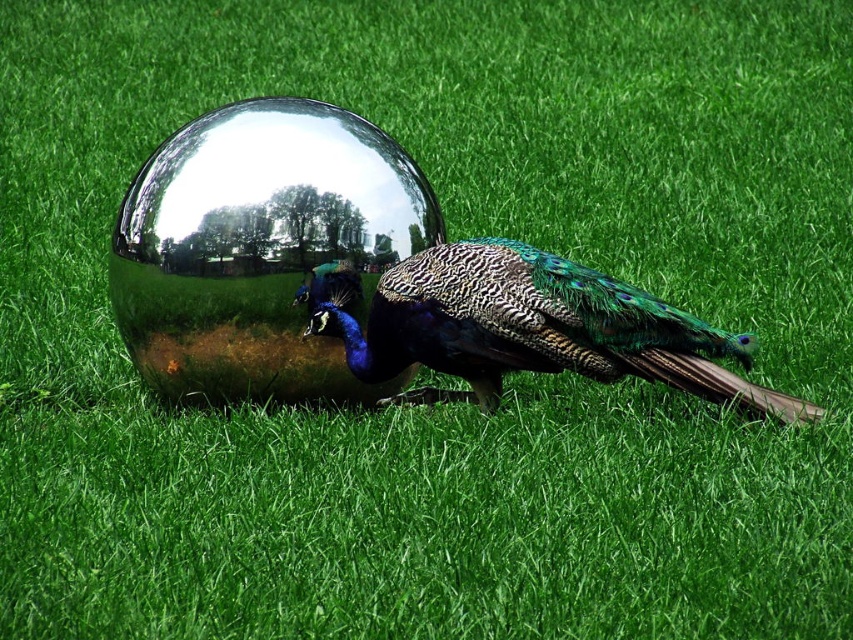
You are standing in front of the peacock and want to take a photo. There are two points marked in the image, point 1 at coordinates point (473, 276) and point 2 at coordinates point (753, 413). Which point is closer to you?

Point (473, 276) is closer to the camera than point (753, 413), so point 1 is closer to you.

You are standing in front of the image and want to place a small flag exactly between the shiny metallic sphere at center and the shiny metallic peacock at center. Which object will the flag be closer to?

The flag will be closer to the shiny metallic peacock at center because the shiny metallic sphere at center is positioned to the left of the shiny metallic peacock at center.